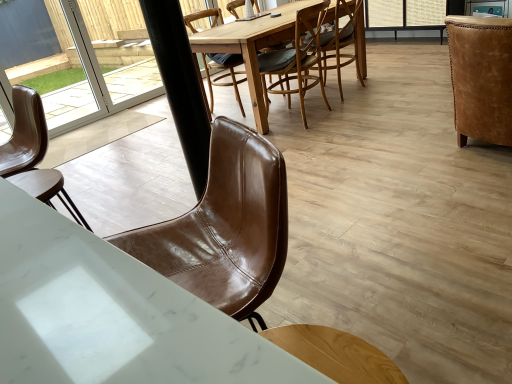
Question: Relative to transparent glass door at upper left, is white marble desk at lower left in front or behind?

Choices:
 (A) front
 (B) behind

Answer: (A)

Question: From a real-world perspective, relative to transparent glass door at upper left, is white marble desk at lower left vertically above or below?

Choices:
 (A) below
 (B) above

Answer: (A)

Question: Which object is the farthest from the wooden round table at center?

Choices:
 (A) light brown leather chair at center, the 4th chair from the left
 (B) brown leather chair at left, placed as the 5th chair when sorted from right to left
 (C) black matte pole at center
 (D) brown leather chair at center, arranged as the 3th chair when viewed from the left
 (E) brown leather chair at center, positioned as the 4th chair in right-to-left order

Answer: (B)

Question: Which object is positioned farthest from the brown leather chair at center, arranged as the 3th chair when viewed from the left?

Choices:
 (A) transparent glass door at upper left
 (B) black matte pole at center
 (C) white marble desk at lower left
 (D) leather armchair at right, placed as the 5th chair when sorted from left to right
 (E) light brown leather chair at center, the 4th chair from the left

Answer: (C)